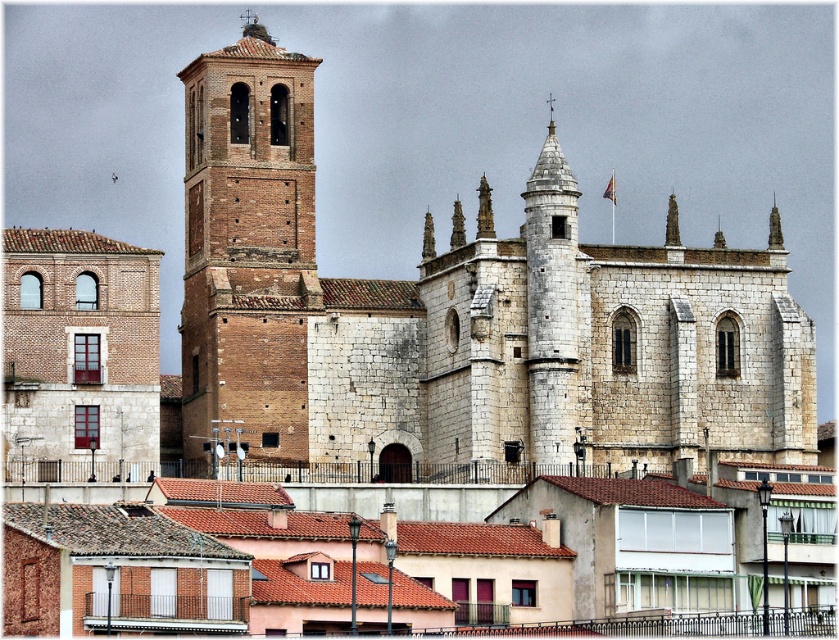
You are standing in front of the historical church and notice two brick towers. The first is labeled as the brick tower at upper left, and the second is the brick tower at left. Which tower would block your view of the other if you were to stand directly in front of the church?

The brick tower at upper left is in front of the brick tower at left, so it would block your view of the brick tower at left.

You are an architect analyzing the historical area. You observe the brick tower at upper left and the brick tower at left. Which of these two towers is taller?

The brick tower at upper left is taller than the brick tower at left.